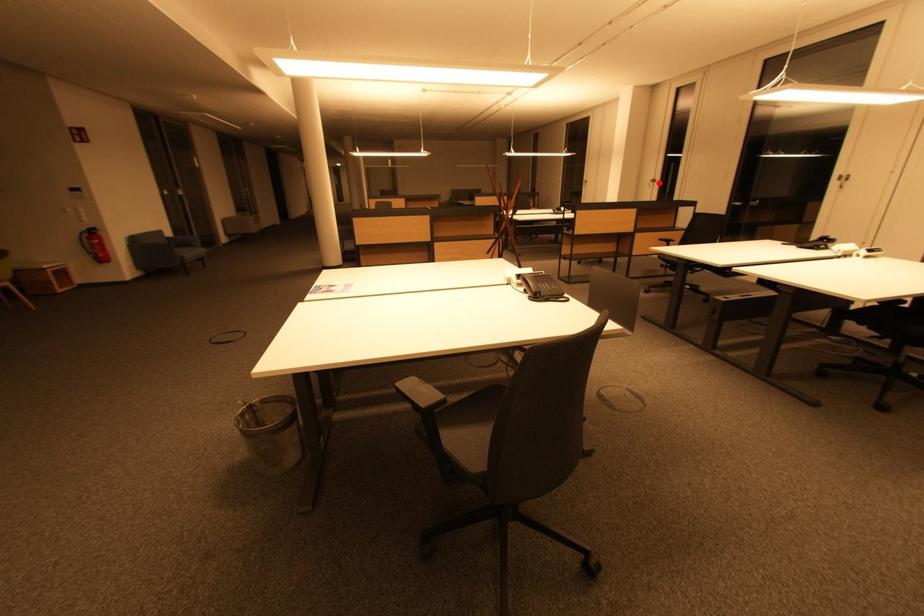
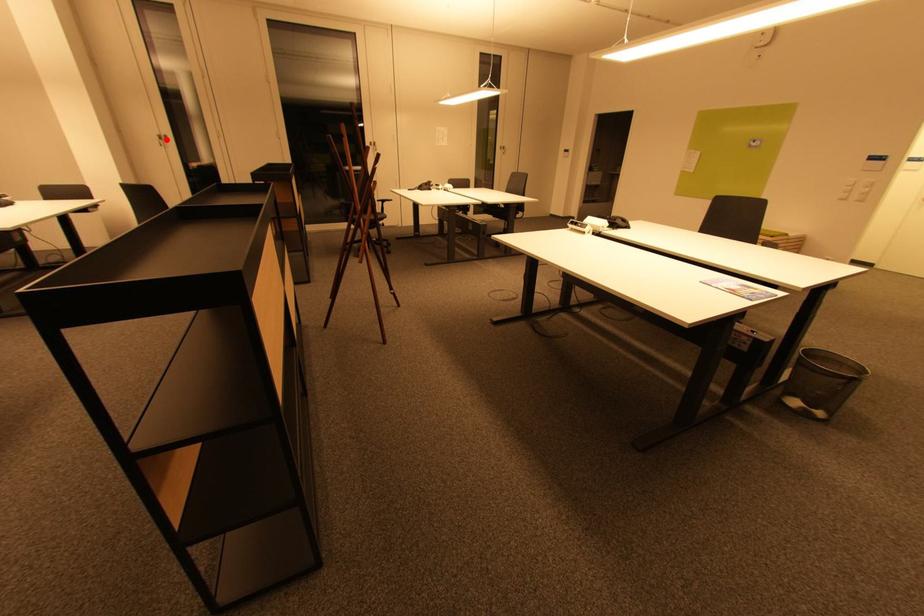
I am providing you with two images of the same scene from different viewpoints. A red point is marked on the first image and another point is marked on the second image. Are the points marked in image1 and image2 representing the same 3D position?

Yes